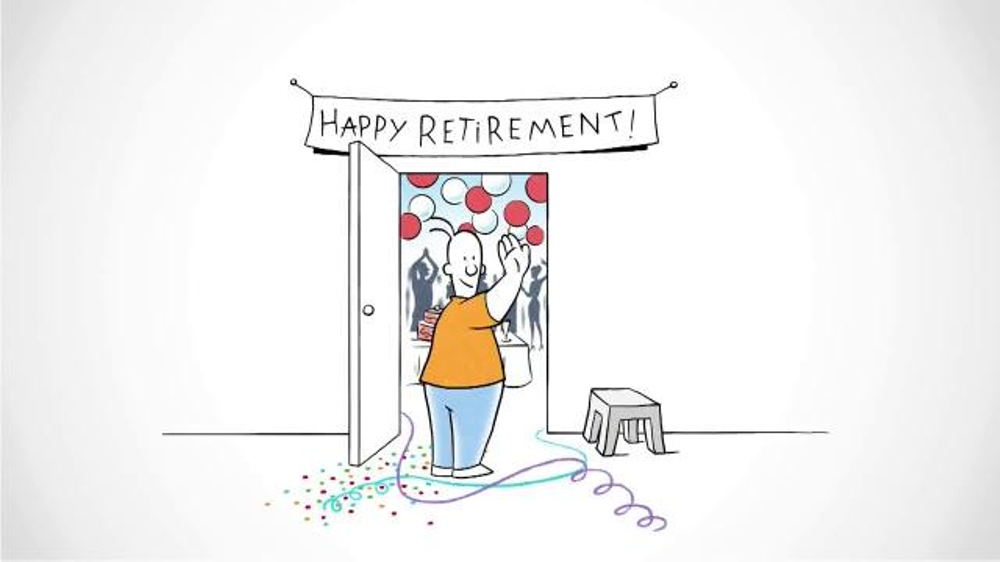
Locate an element on the screen. Image resolution: width=1000 pixels, height=562 pixels. stool drawing is located at coordinates (612, 448), (598, 423), (608, 398), (655, 406).